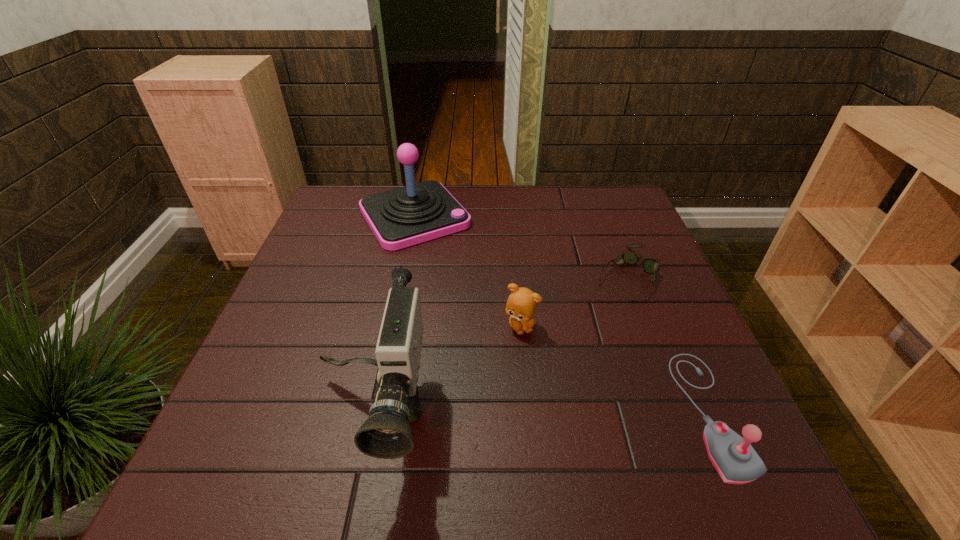
I want to click on blank region between the teddy bear and the spectacles, so (574, 301).

I want to click on free space between the left joystick and the teddy bear, so click(x=468, y=271).

Locate an element on the screen. The height and width of the screenshot is (540, 960). object that is the closest to the camcorder is located at coordinates (521, 305).

This screenshot has width=960, height=540. In order to click on object that is the fourth closest to the farther joystick in this screenshot , I will do `click(733, 457)`.

Image resolution: width=960 pixels, height=540 pixels. Find the location of `vacant position in the image that satisfies the following two spatial constraints: 1. on the front side of the shortest object; 2. on the left side of the shorter joystick`. vacant position in the image that satisfies the following two spatial constraints: 1. on the front side of the shortest object; 2. on the left side of the shorter joystick is located at coordinates (680, 413).